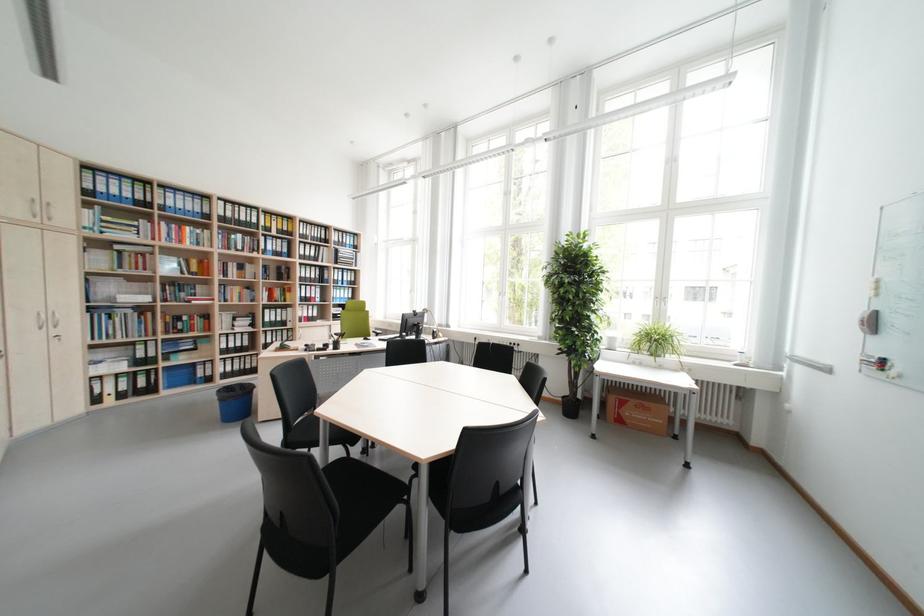
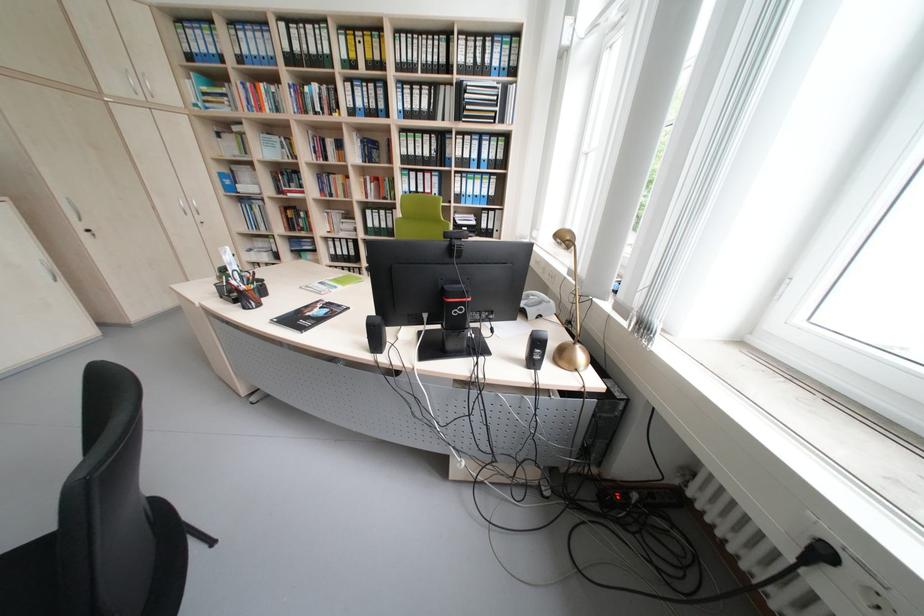
In the second image, find the point that corresponds to point 185,261 in the first image.

(286, 140)